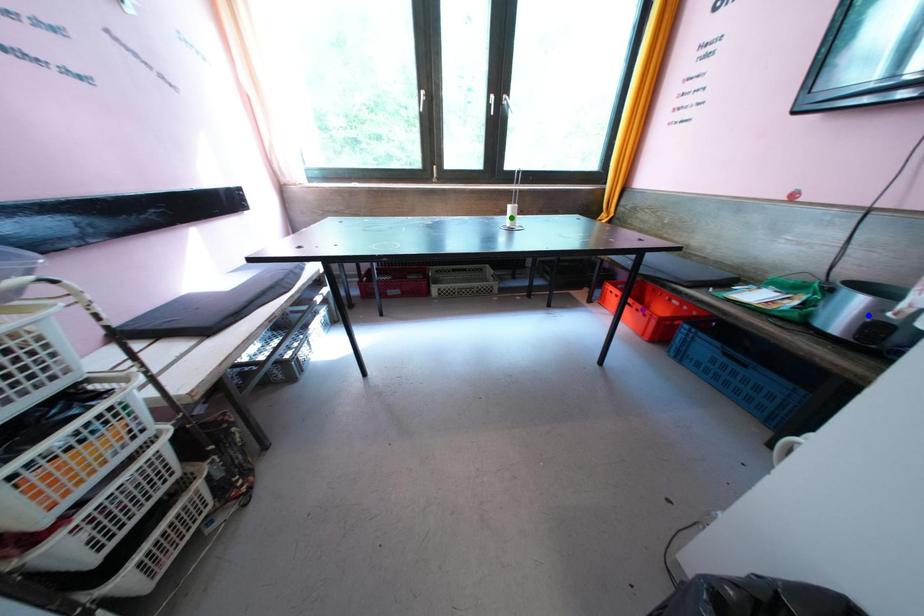
Order these from nearest to farthest:
- purple point
- blue point
- green point

blue point, green point, purple point